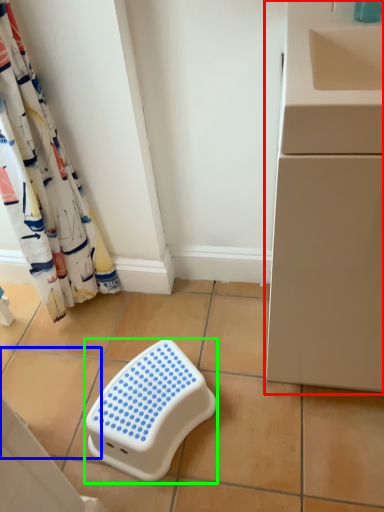
Question: Which object is the closest to the counter (highlighted by a red box)? Choose among these: ceramic tile (highlighted by a blue box) or furniture (highlighted by a green box).

Choices:
 (A) ceramic tile
 (B) furniture

Answer: (B)